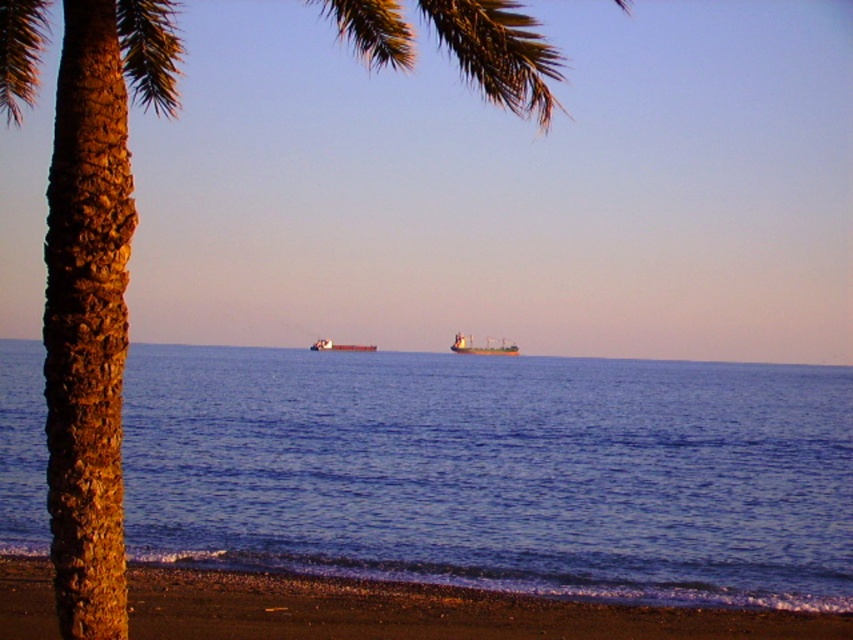
You are standing on the smooth sand beach at lower left and want to see the brown matte cargo ship at center. Can you see the entire ship from your current position?

The smooth sand beach at lower left has a lesser height compared to brown matte cargo ship at center, so yes, you can see the entire ship from your current position because the beach is lower and the ship is higher.

Looking at this image, you are standing on the smooth sand beach at lower left and want to take a photo of the brown textured palm tree at left. Since the palm tree is in front of the beach, will the tree block your view of the beach in the photo?

The brown textured palm tree at left is in front of the smooth sand beach at lower left, so the tree will block part of the beach in the photo.

Consider the image. You are standing on the smooth sand beach at lower left and want to take a photo of the brown textured palm tree at left. Will the palm tree be fully visible in the photo if you stand where you are?

The brown textured palm tree at left is much taller than the smooth sand beach at lower left, so yes, the palm tree will be fully visible in the photo.